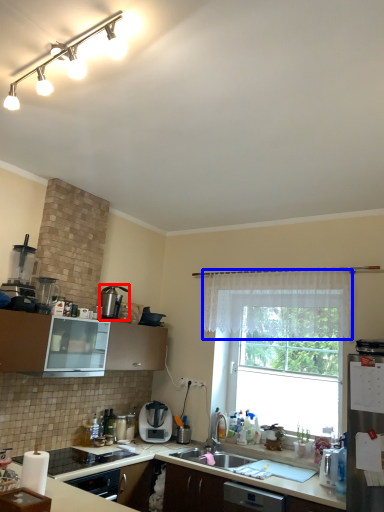
Question: Which object is further to the camera taking this photo, kitchen appliance (highlighted by a red box) or curtain (highlighted by a blue box)?

Choices:
 (A) kitchen appliance
 (B) curtain

Answer: (A)